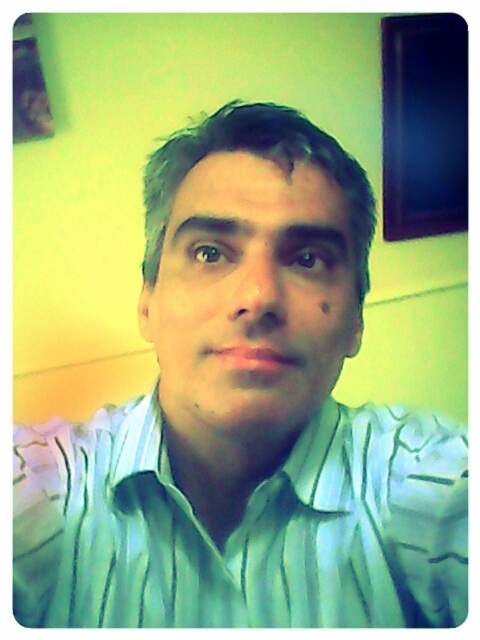
You are trying to determine which shirt is closer to you in the image. Both the green striped dress shirt at center and the matte green shirt at center are visible. Which one is in front?

The matte green shirt at center is behind the green striped dress shirt at center, so the green striped dress shirt at center is in front.

You are a photographer trying to decide which shirt to recommend for a client based on their preference for a more fitted look. Given that the client prefers a narrower width, which shirt between the green striped dress shirt at center and the matte green shirt at center would you suggest?

The matte green shirt at center has a narrower width compared to the green striped dress shirt at center, so it would be the better recommendation for a more fitted look.